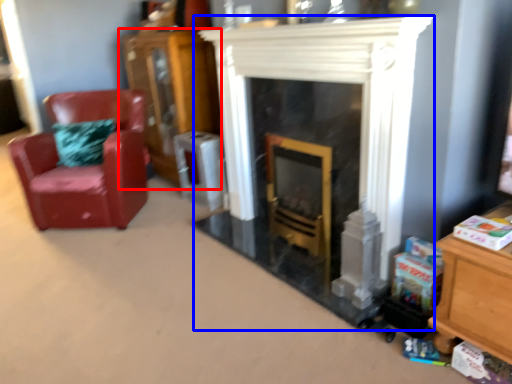
Question: Which object is closer to the camera taking this photo, dresser (highlighted by a red box) or fireplace (highlighted by a blue box)?

Choices:
 (A) dresser
 (B) fireplace

Answer: (B)